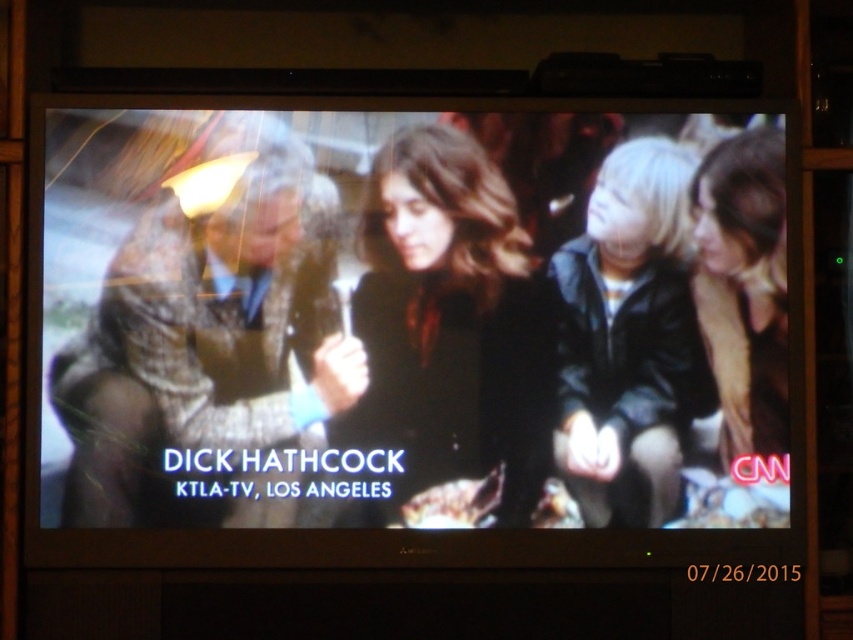
Question: Which object is the farthest from the matte black jacket at center?

Choices:
 (A) brown textured coat at left
 (B) matte black coat at center
 (C) black leather jacket at right

Answer: (C)

Question: Does matte black jacket at center have a larger size compared to matte black coat at center?

Choices:
 (A) no
 (B) yes

Answer: (B)

Question: Does matte black coat at center appear under black leather jacket at right?

Choices:
 (A) no
 (B) yes

Answer: (A)

Question: Observing the image, what is the correct spatial positioning of matte black jacket at center in reference to matte black coat at center?

Choices:
 (A) right
 (B) left

Answer: (B)

Question: Which point is closer to the camera?

Choices:
 (A) (670, 412)
 (B) (738, 326)
 (C) (149, 285)

Answer: (C)

Question: Which point is closer to the camera?

Choices:
 (A) black leather jacket at right
 (B) matte black jacket at center
 (C) brown textured coat at left
 (D) matte black coat at center

Answer: (B)